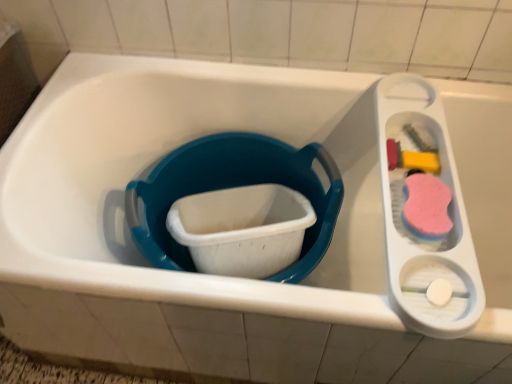
Describe the element at coordinates (231, 187) in the screenshot. I see `blue plastic bucket at center` at that location.

Where is `blue plastic bucket at center`? This screenshot has height=384, width=512. blue plastic bucket at center is located at coordinates point(231,187).

What are the coordinates of `blue plastic bucket at center` in the screenshot? It's located at (231, 187).